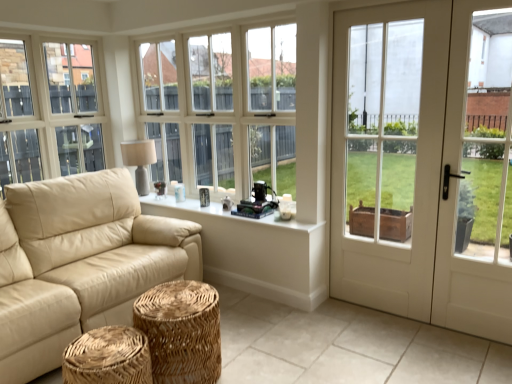
What are the coordinates of `free space that is in between woven natural stool at center, placed as the second stool when sorted from front to back, and white glossy door at right` in the screenshot? It's located at (340, 343).